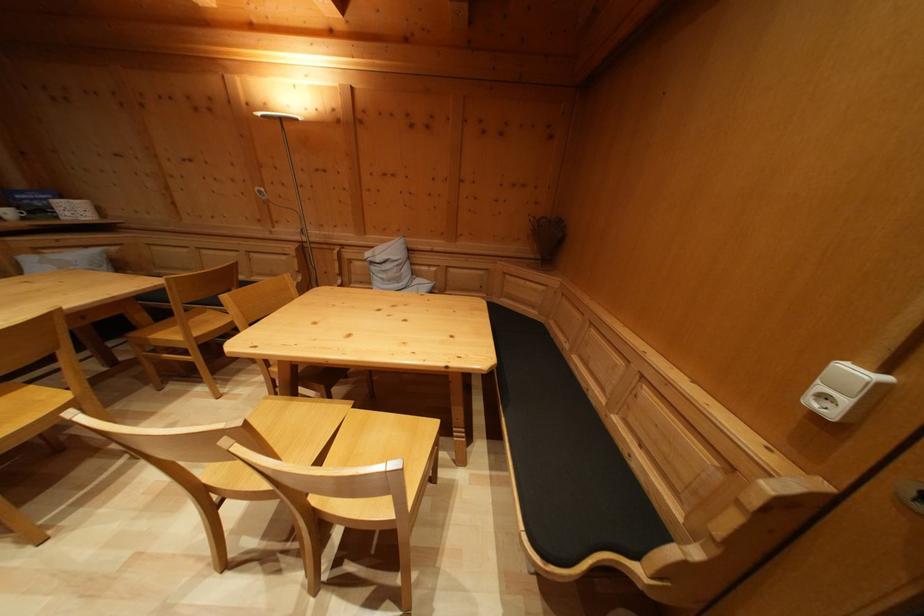
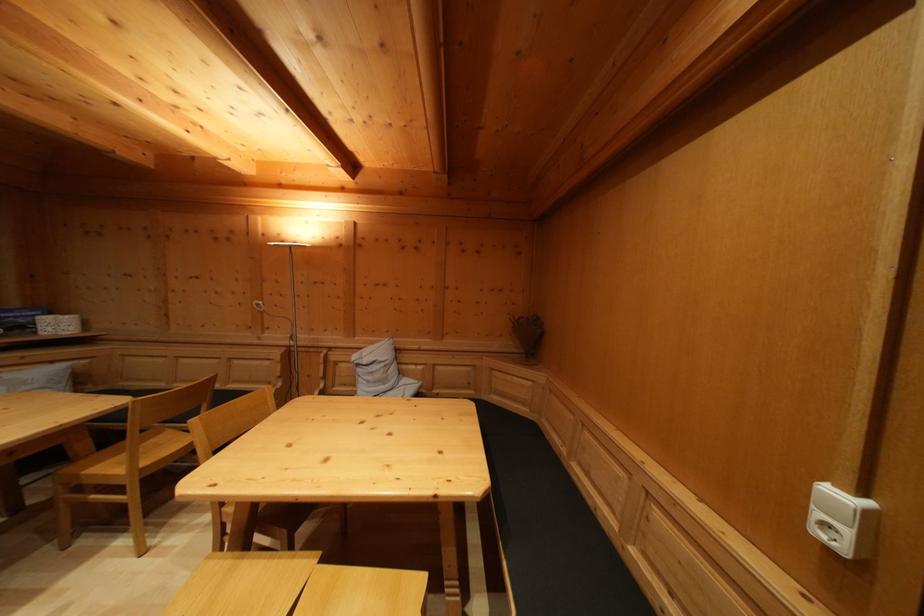
Question: The images are taken continuously from a first-person perspective. In which direction is your viewpoint rotating?

Choices:
 (A) Left
 (B) Right
 (C) Up
 (D) Down

Answer: (C)